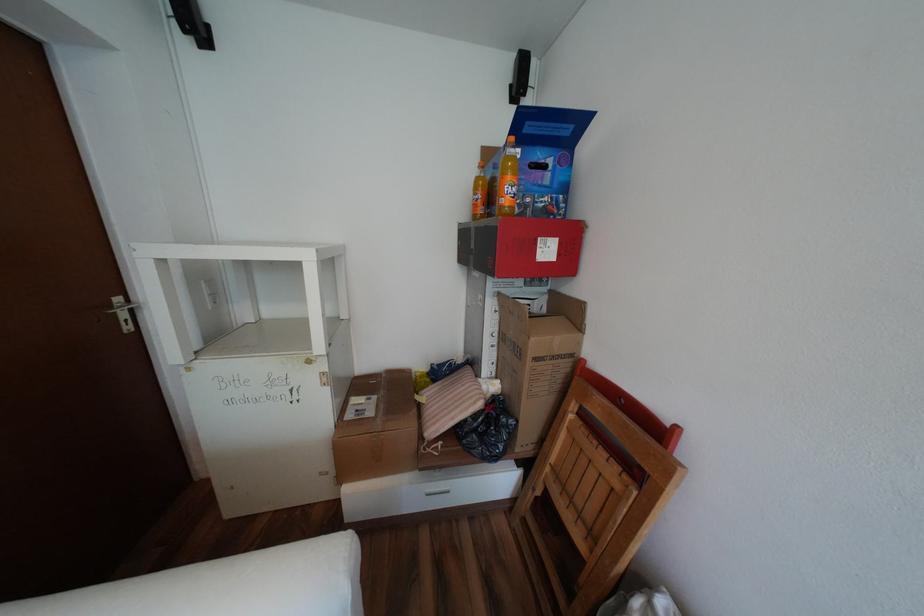
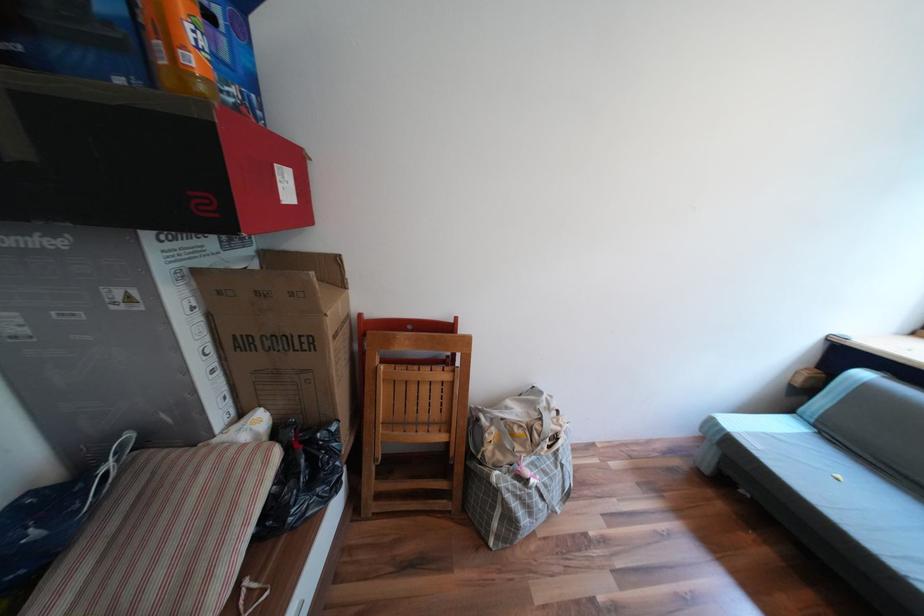
Locate, in the second image, the point that corresponds to [505,334] in the first image.

(219, 349)